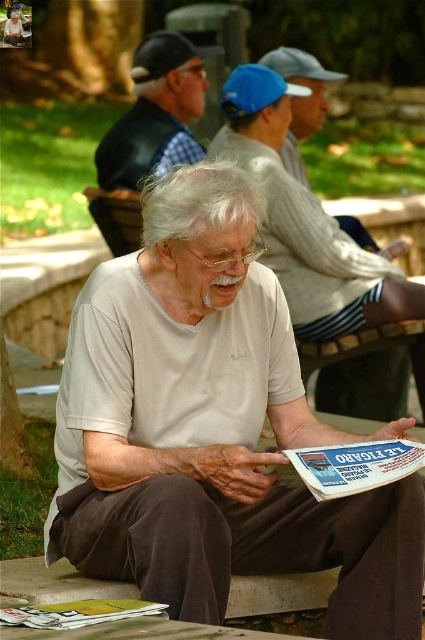
You are a photographer trying to capture the elderly man reading the newspaper. To ensure both the white cotton shirt at center and the printed paper newspaper at center are clearly visible in the photo, which object should you focus on first considering their sizes?

The white cotton shirt at center has a greater height compared to the printed paper newspaper at center, so you should focus on the white cotton shirt at center first as it is larger and more prominent.

You are a photographer trying to capture a candid shot of the elderly man reading Le Figaro. You notice the white matte shirt at center and the checkered fabric vest at upper left in your frame. Which object should you avoid blocking to ensure the elderly man remains visible?

The white matte shirt at center is taller than the checkered fabric vest at upper left. To ensure the elderly man remains visible, avoid blocking the white matte shirt at center as it is taller and may obscure the view.